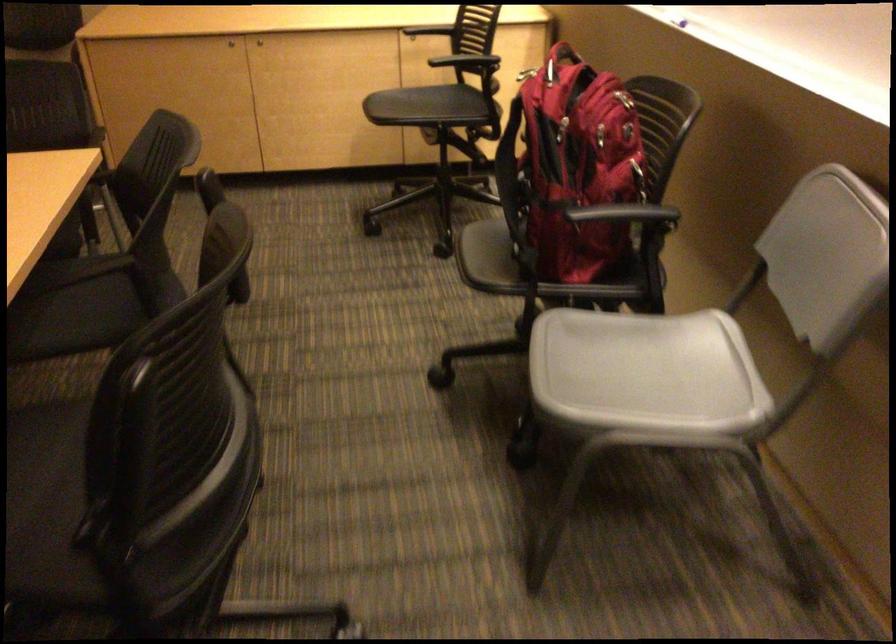
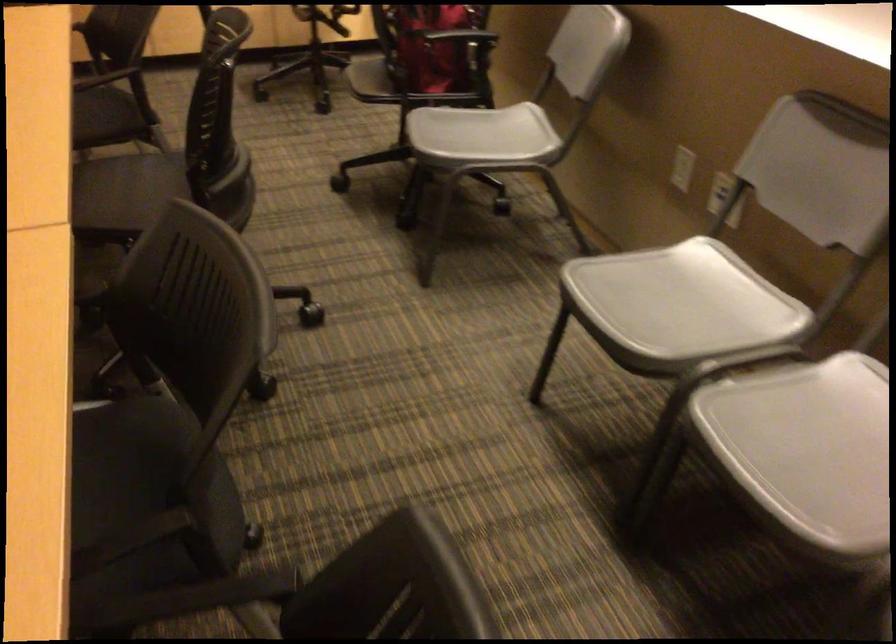
Question: The camera is either moving clockwise (left) or counter-clockwise (right) around the object. The first image is from the beginning of the video and the second image is from the end. Is the camera moving left or right when shooting the video?

Choices:
 (A) Left
 (B) Right

Answer: (A)